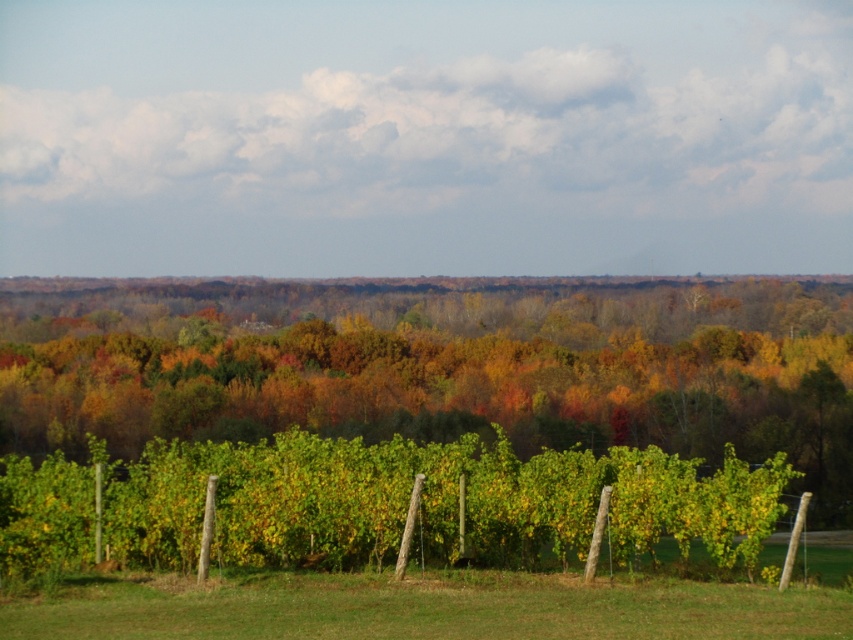
Question: Does green leafy vines at center appear over green grass at lower center?

Choices:
 (A) no
 (B) yes

Answer: (B)

Question: Can you confirm if green leafy vines at center is bigger than green grass at lower center?

Choices:
 (A) yes
 (B) no

Answer: (A)

Question: Does green leafy vines at center have a greater width compared to green grass at lower center?

Choices:
 (A) no
 (B) yes

Answer: (B)

Question: Which point appears closest to the camera in this image?

Choices:
 (A) (289, 632)
 (B) (747, 532)

Answer: (A)

Question: Which point is closer to the camera?

Choices:
 (A) (77, 470)
 (B) (198, 605)

Answer: (B)